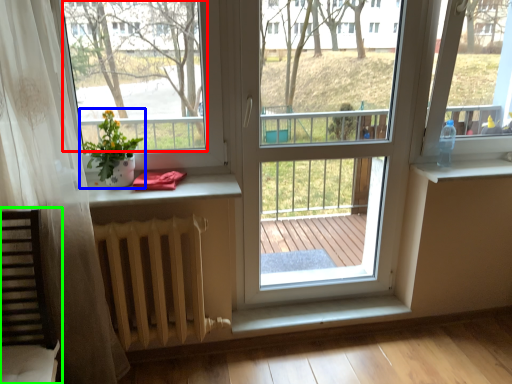
Question: Considering the real-world distances, which object is closest to window screen (highlighted by a red box)? houseplant (highlighted by a blue box) or rocking chair (highlighted by a green box).

Choices:
 (A) houseplant
 (B) rocking chair

Answer: (A)